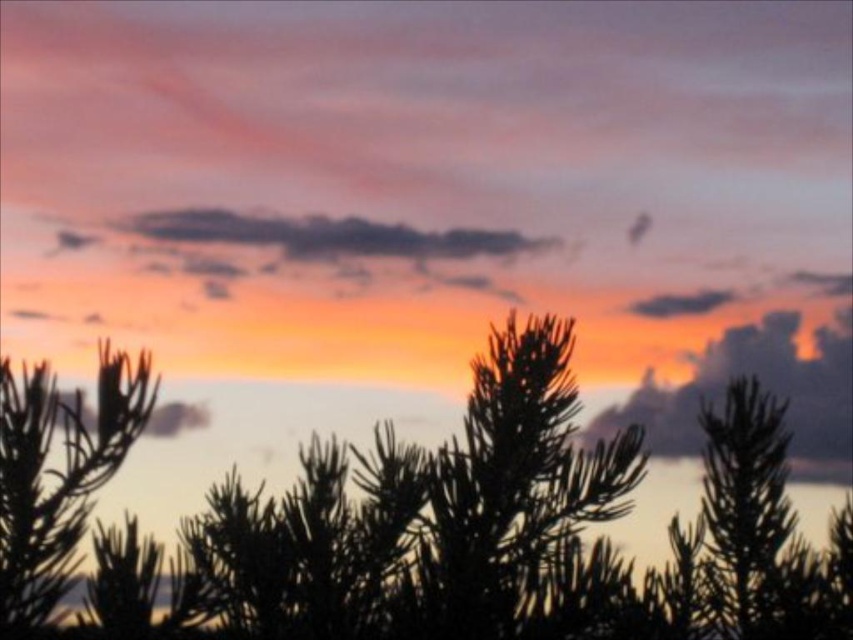
You are an artist trying to sketch this sunset scene. You want to ensure the silhouette pine tree at center and the dark gray cloud at upper center are proportionally accurate. Based on the scene, which object should you draw wider in your sketch?

The silhouette pine tree at center should be drawn wider in your sketch since it might be wider than the dark gray cloud at upper center according to the description.

You are an artist trying to paint this sunset scene. You notice the silvery green needles at left and the dark gray cloud at upper center. Which object should you paint first to maintain proper depth perception?

You should paint the silvery green needles at left first because they are closer to the viewer than the dark gray cloud at upper center, ensuring depth perception is maintained by layering closer objects over distant ones.

You are an artist painting this sunset scene. You want to paint the silhouette pine tree at center and the silvery green needles at left. Which object should you paint first to follow the correct layering technique?

You should paint the silvery green needles at left first because the silhouette pine tree at center is closer to the viewer and will be painted over it to maintain proper layering.